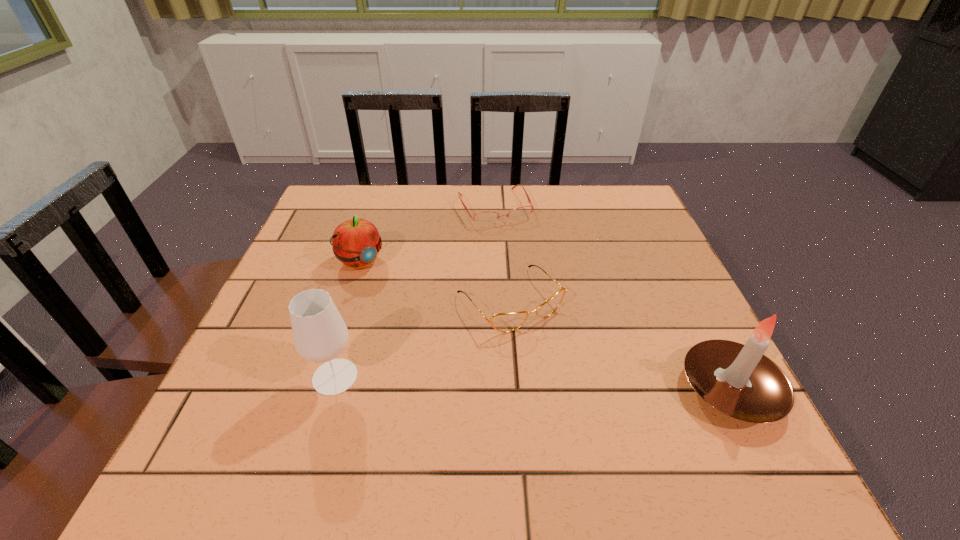
Where is `vacant space at the near right corner`? Image resolution: width=960 pixels, height=540 pixels. vacant space at the near right corner is located at coordinates (680, 399).

You are a GUI agent. You are given a task and a screenshot of the screen. Output one action in this format:
    pyautogui.click(x=<x>, y=<y>)
    Task: Click on the vacant space that is in between the candle and the glass
    
    Given the screenshot: What is the action you would take?
    pyautogui.click(x=533, y=383)

Find the location of a particular element. free spot between the glass and the taller spectacles is located at coordinates (422, 339).

You are a GUI agent. You are given a task and a screenshot of the screen. Output one action in this format:
    pyautogui.click(x=<x>, y=<y>)
    Task: Click on the empty space that is in between the rightmost object and the farthest object
    The height and width of the screenshot is (540, 960).
    Given the screenshot: What is the action you would take?
    pyautogui.click(x=612, y=298)

Find the location of a particular element. The image size is (960, 540). vacant space that's between the glass and the candle is located at coordinates (533, 383).

Locate an element on the screen. The image size is (960, 540). unoccupied position between the nearer spectacles and the glass is located at coordinates (422, 339).

Find the location of a particular element. Image resolution: width=960 pixels, height=540 pixels. free space between the candle and the apple is located at coordinates tap(545, 326).

Image resolution: width=960 pixels, height=540 pixels. Find the location of `free point between the nearer spectacles and the glass`. free point between the nearer spectacles and the glass is located at coordinates (422, 339).

What are the coordinates of `unoccupied area between the farther spectacles and the rightmost object` in the screenshot? It's located at (612, 298).

The width and height of the screenshot is (960, 540). In order to click on free space between the farther spectacles and the glass in this screenshot , I will do `click(415, 292)`.